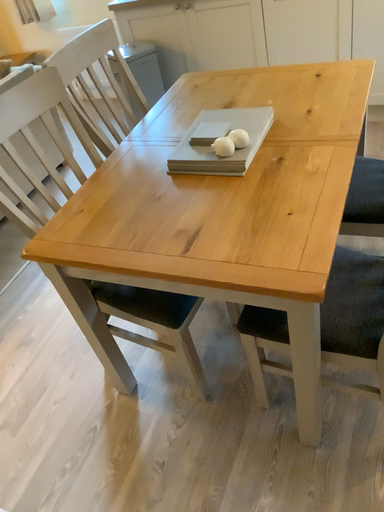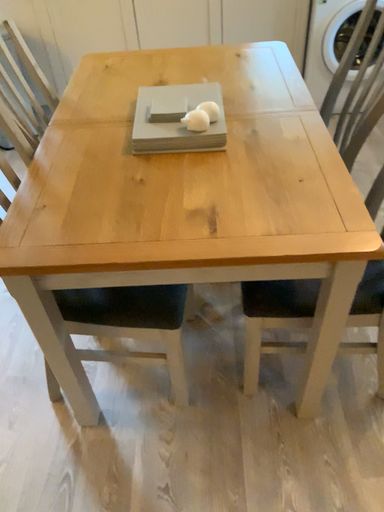
Question: How did the camera likely rotate when shooting the video?

Choices:
 (A) rotated right
 (B) rotated left

Answer: (A)